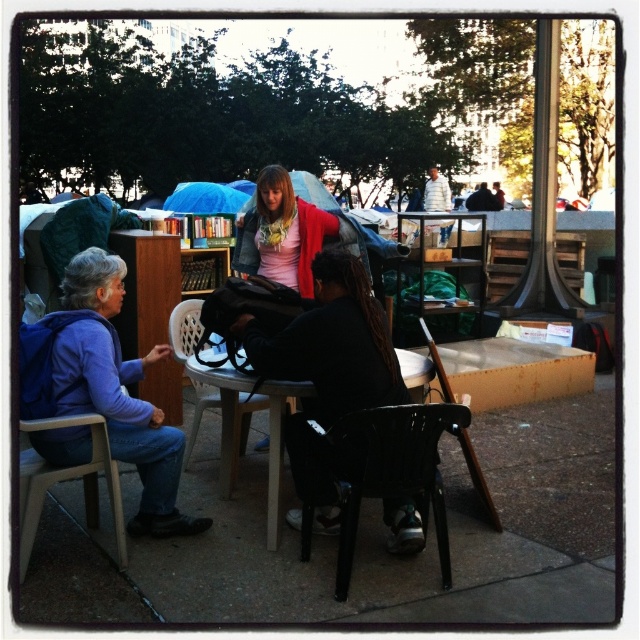
Question: Does wooden chair at lower left appear under dark gray jacket at center?

Choices:
 (A) yes
 (B) no

Answer: (A)

Question: Which object is closer to the camera taking this photo?

Choices:
 (A) matte purple jacket at left
 (B) white plastic chair at center
 (C) black plastic folding chair at lower center
 (D) white plastic table at center

Answer: (C)

Question: Which object is positioned farthest from the white plastic table at center?

Choices:
 (A) black plastic folding chair at lower center
 (B) white plastic chair at center
 (C) wooden chair at lower left
 (D) matte purple jacket at left

Answer: (C)

Question: Which of the following is the farthest from the observer?

Choices:
 (A) (440, 232)
 (B) (292, 387)

Answer: (A)

Question: From the image, what is the correct spatial relationship of black plastic folding chair at lower center in relation to white cotton shirt at upper right?

Choices:
 (A) above
 (B) below

Answer: (B)

Question: Does white plastic chair at center lie in front of dark gray jacket at center?

Choices:
 (A) yes
 (B) no

Answer: (A)